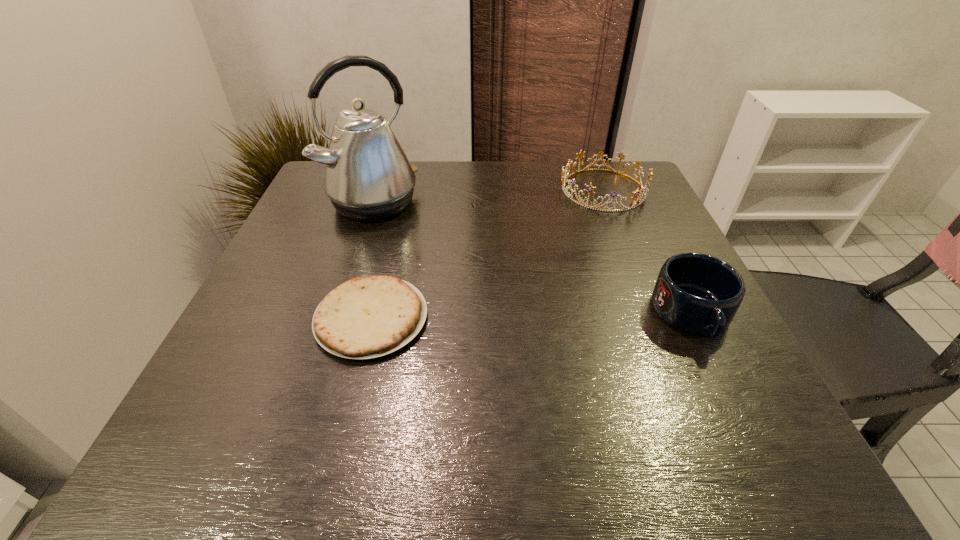
Find the location of a particular element. The image size is (960, 540). free spot between the tiara and the tortilla is located at coordinates [488, 254].

Where is `vacant area that lies between the shortest object and the tiara`? The width and height of the screenshot is (960, 540). vacant area that lies between the shortest object and the tiara is located at coordinates (488, 254).

This screenshot has width=960, height=540. Identify the location of vacant area between the mug and the tiara. (648, 252).

This screenshot has height=540, width=960. Find the location of `vacant area that lies between the mug and the tiara`. vacant area that lies between the mug and the tiara is located at coordinates (648, 252).

Locate an element on the screen. The width and height of the screenshot is (960, 540). free space between the mug and the tiara is located at coordinates (648, 252).

Find the location of a particular element. free space between the tiara and the mug is located at coordinates (648, 252).

The height and width of the screenshot is (540, 960). I want to click on free space between the mug and the tiara, so click(648, 252).

The height and width of the screenshot is (540, 960). I want to click on empty space between the tallest object and the mug, so click(533, 259).

Locate which object is the closest to the tiara. Please provide its 2D coordinates. Your answer should be formatted as a tuple, i.e. [(x, y)], where the tuple contains the x and y coordinates of a point satisfying the conditions above.

[(697, 293)]

The width and height of the screenshot is (960, 540). What are the coordinates of `object identified as the closest to the tiara` in the screenshot? It's located at (697, 293).